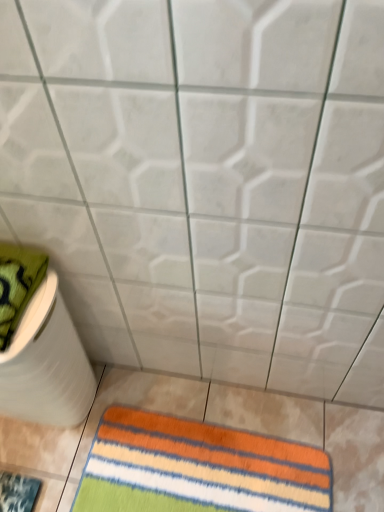
Question: From the image's perspective, is multicolored striped rug at lower center located above green textured towel at left?

Choices:
 (A) yes
 (B) no

Answer: (B)

Question: Is multicolored striped rug at lower center to the left of green textured towel at left from the viewer's perspective?

Choices:
 (A) no
 (B) yes

Answer: (A)

Question: Could green textured towel at left be considered to be inside multicolored striped rug at lower center?

Choices:
 (A) yes
 (B) no

Answer: (B)

Question: Does multicolored striped rug at lower center have a greater height compared to green textured towel at left?

Choices:
 (A) yes
 (B) no

Answer: (B)

Question: Considering the relative sizes of multicolored striped rug at lower center and green textured towel at left in the image provided, is multicolored striped rug at lower center bigger than green textured towel at left?

Choices:
 (A) yes
 (B) no

Answer: (B)

Question: Does multicolored striped rug at lower center come behind green textured towel at left?

Choices:
 (A) yes
 (B) no

Answer: (A)

Question: Are green textured towel at left and multicolored striped rug at lower left making contact?

Choices:
 (A) yes
 (B) no

Answer: (B)

Question: From a real-world perspective, does green textured towel at left stand above multicolored striped rug at lower left?

Choices:
 (A) no
 (B) yes

Answer: (B)

Question: From the image's perspective, is green textured towel at left beneath multicolored striped rug at lower left?

Choices:
 (A) no
 (B) yes

Answer: (A)

Question: Is green textured towel at left at the right side of multicolored striped rug at lower left?

Choices:
 (A) no
 (B) yes

Answer: (B)

Question: Is green textured towel at left facing towards multicolored striped rug at lower left?

Choices:
 (A) no
 (B) yes

Answer: (A)

Question: Is green textured towel at left at the left side of multicolored striped rug at lower left?

Choices:
 (A) yes
 (B) no

Answer: (B)

Question: Could you tell me if white matte toilet paper at lower left is turned towards green textured towel at left?

Choices:
 (A) yes
 (B) no

Answer: (B)